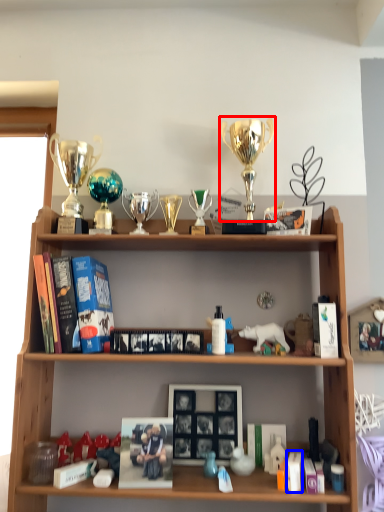
Question: Which of the following is the farthest to the observer, trophy (highlighted by a red box) or book (highlighted by a blue box)?

Choices:
 (A) trophy
 (B) book

Answer: (A)